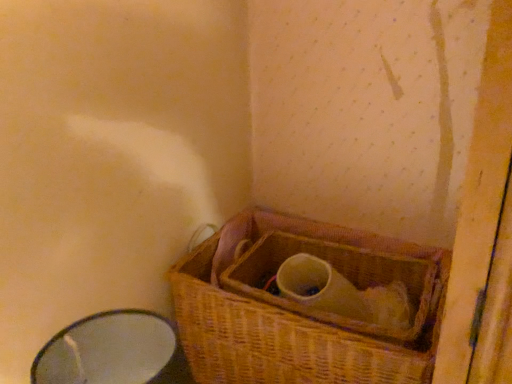
What do you see at coordinates (301, 306) in the screenshot?
I see `woven brown picnic basket at lower right` at bounding box center [301, 306].

The width and height of the screenshot is (512, 384). In order to click on woven brown picnic basket at lower right in this screenshot , I will do `click(301, 306)`.

This screenshot has width=512, height=384. Identify the location of woven brown picnic basket at lower right. (301, 306).